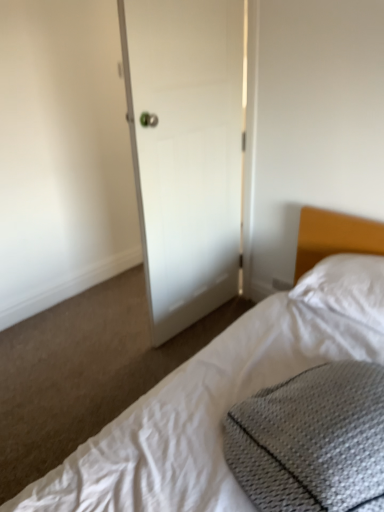
Question: Is white soft pillow at right inside the boundaries of white matte door at center, or outside?

Choices:
 (A) outside
 (B) inside

Answer: (A)

Question: Looking at their shapes, would you say white soft pillow at right is wider or thinner than white matte door at center?

Choices:
 (A) thin
 (B) wide

Answer: (B)

Question: Estimate the real-world distances between objects in this image. Which object is farther from the white soft pillow at right?

Choices:
 (A) white matte door at center
 (B) gray textured pillow at lower right
 (C) white textured bed at lower right

Answer: (A)

Question: Which object is positioned farthest from the gray textured pillow at lower right?

Choices:
 (A) white textured bed at lower right
 (B) white soft pillow at right
 (C) white matte door at center

Answer: (C)